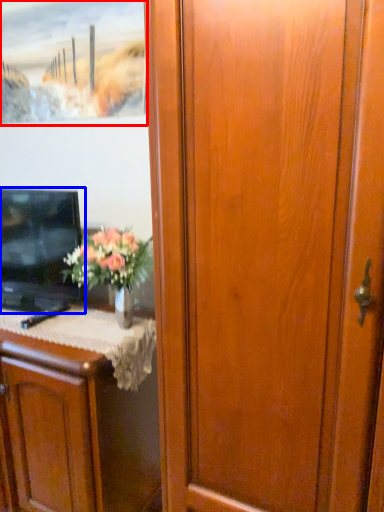
Question: Which of the following is the farthest to the observer, picture frame (highlighted by a red box) or television (highlighted by a blue box)?

Choices:
 (A) picture frame
 (B) television

Answer: (A)